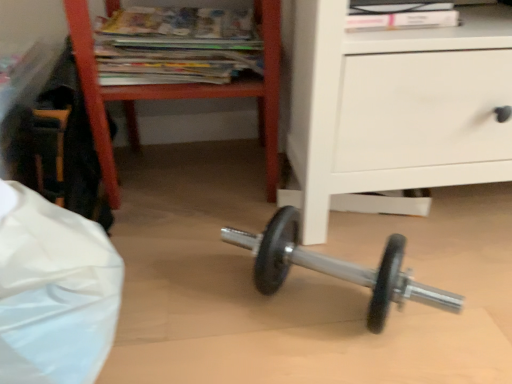
Question: Considering the relative positions of wooden magazine rack at upper left and matte paper magazines at upper center in the image provided, is wooden magazine rack at upper left to the left or to the right of matte paper magazines at upper center?

Choices:
 (A) left
 (B) right

Answer: (B)

Question: Considering the positions of wooden magazine rack at upper left and matte paper magazines at upper center in the image, is wooden magazine rack at upper left taller or shorter than matte paper magazines at upper center?

Choices:
 (A) short
 (B) tall

Answer: (B)

Question: Which is correct: wooden magazine rack at upper left is inside matte paper magazines at upper center, or outside of it?

Choices:
 (A) inside
 (B) outside

Answer: (B)

Question: Considering their positions, is matte paper magazines at upper center located in front of or behind wooden magazine rack at upper left?

Choices:
 (A) behind
 (B) front

Answer: (A)

Question: From a real-world perspective, is matte paper magazines at upper center physically located above or below wooden magazine rack at upper left?

Choices:
 (A) above
 (B) below

Answer: (A)

Question: Considering the positions of matte paper magazines at upper center and wooden magazine rack at upper left in the image, is matte paper magazines at upper center bigger or smaller than wooden magazine rack at upper left?

Choices:
 (A) small
 (B) big

Answer: (A)

Question: Is matte paper magazines at upper center situated inside wooden magazine rack at upper left or outside?

Choices:
 (A) outside
 (B) inside

Answer: (B)